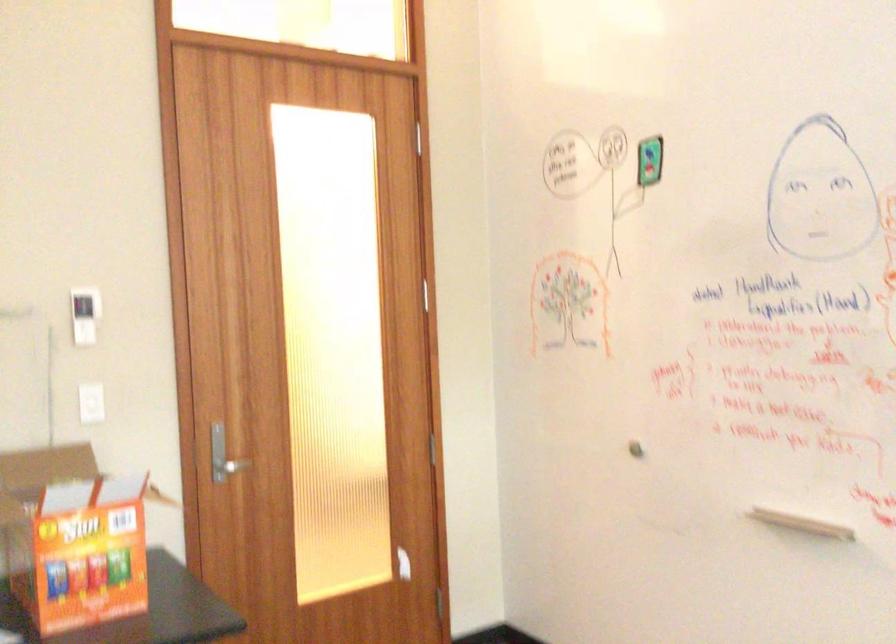
Find where to push the white light switch. Please return your answer as a coordinate pair (x, y).

(84, 315)